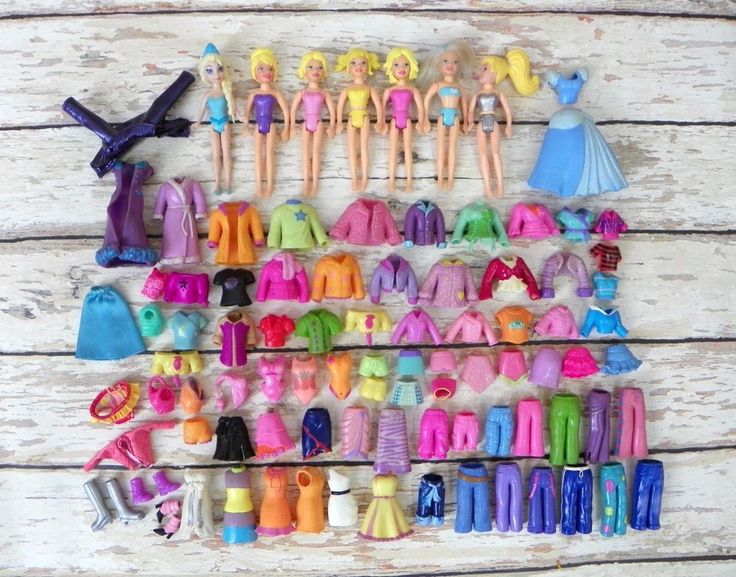
Identify the location of plastic doll shoes. (137, 494), (168, 483), (166, 505), (168, 528), (121, 511), (99, 517).